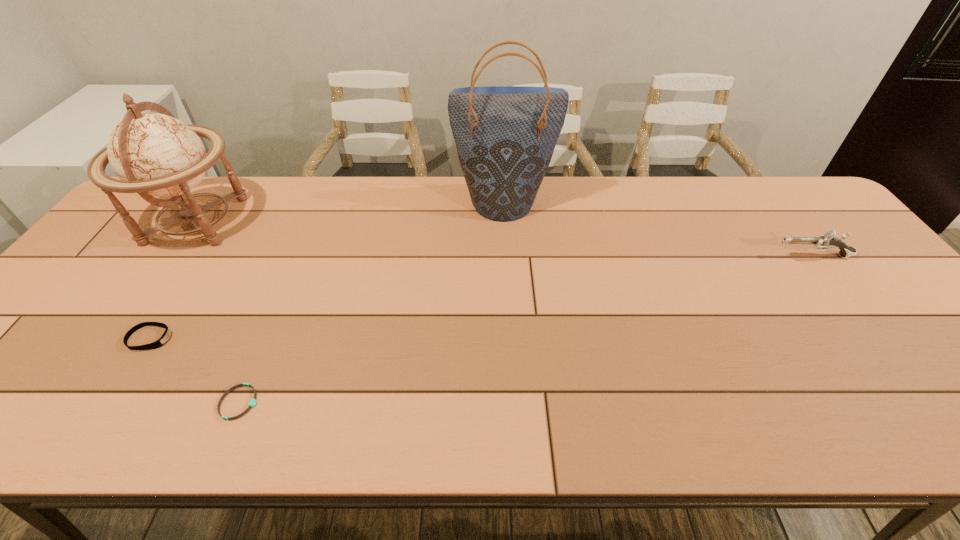
Image resolution: width=960 pixels, height=540 pixels. I want to click on blank area located on the front-facing side of the globe, so click(274, 220).

The image size is (960, 540). In order to click on free spot located aimed along the barrel of the rightmost object in this screenshot , I will do coord(716,256).

The height and width of the screenshot is (540, 960). In order to click on vacant area situated 0.230m aimed along the barrel of the rightmost object in this screenshot , I will do `click(691, 256)`.

The image size is (960, 540). Find the location of `vacant space positioned 0.260m aimed along the barrel of the rightmost object`. vacant space positioned 0.260m aimed along the barrel of the rightmost object is located at coordinates (680, 256).

Identify the location of free space located 0.050m on the display of the farther wristband. This screenshot has height=540, width=960. (192, 339).

At what (x,y) coordinates should I click in order to perform the action: click on vacant region located on the buckle of the nearest object. Please return your answer as a coordinate pair (x, y). This screenshot has height=540, width=960. Looking at the image, I should click on (363, 402).

Identify the location of shopping bag present at the far edge. The image size is (960, 540). (505, 136).

Where is `globe located at the far edge`? The width and height of the screenshot is (960, 540). globe located at the far edge is located at coordinates (154, 154).

The width and height of the screenshot is (960, 540). Identify the location of object situated at the near edge. (253, 401).

The width and height of the screenshot is (960, 540). I want to click on object present at the left edge, so click(x=154, y=154).